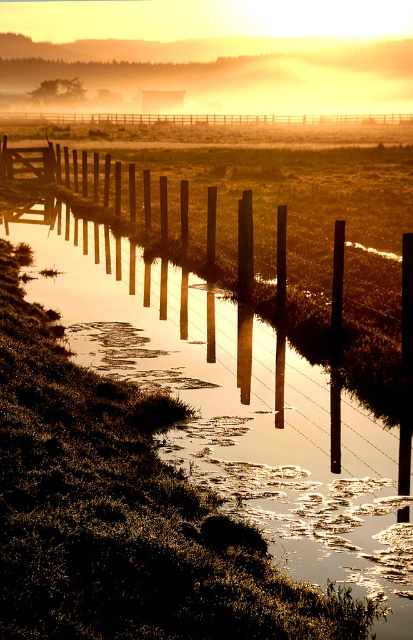
Can you confirm if metallic pole at center-right is bigger than smooth wood post at center?

Actually, metallic pole at center-right might be smaller than smooth wood post at center.

Is metallic pole at center-right thinner than smooth wood post at center?

Indeed, metallic pole at center-right has a lesser width compared to smooth wood post at center.

Where is `metallic pole at center-right`? This screenshot has width=413, height=640. metallic pole at center-right is located at coordinates (336, 346).

Where is `metallic pole at center-right`? The image size is (413, 640). metallic pole at center-right is located at coordinates (336, 346).

Does foggy mist at upper center have a lesser height compared to smooth wood post at center?

Incorrect, foggy mist at upper center's height does not fall short of smooth wood post at center's.

Is point (348, 67) closer to camera compared to point (284, 224)?

No, (348, 67) is behind (284, 224).

Where is `foggy mist at upper center`? Image resolution: width=413 pixels, height=640 pixels. foggy mist at upper center is located at coordinates (223, 72).

Which is more to the right, metallic water at center or wooden posts at center?

Positioned to the right is metallic water at center.

Does point (325, 468) come closer to viewer compared to point (106, 122)?

Yes, it is in front of point (106, 122).

You are a GUI agent. You are given a task and a screenshot of the screen. Output one action in this format:
    pyautogui.click(x=<x>, y=<y>)
    Task: Click on the metallic water at center
    Image resolution: width=413 pixels, height=640 pixels.
    Given the screenshot: What is the action you would take?
    pyautogui.click(x=230, y=404)